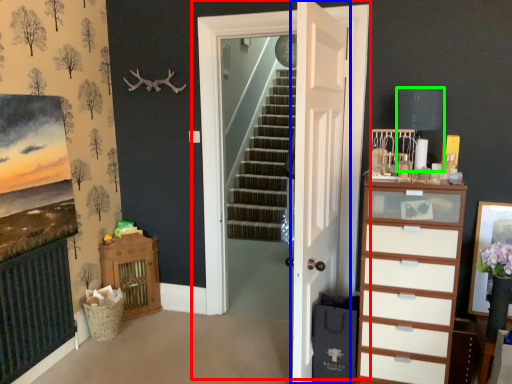
Question: Based on their relative distances, which object is farther from door (highlighted by a red box)? Choose from door (highlighted by a blue box) and lamp (highlighted by a green box).

Choices:
 (A) door
 (B) lamp

Answer: (B)